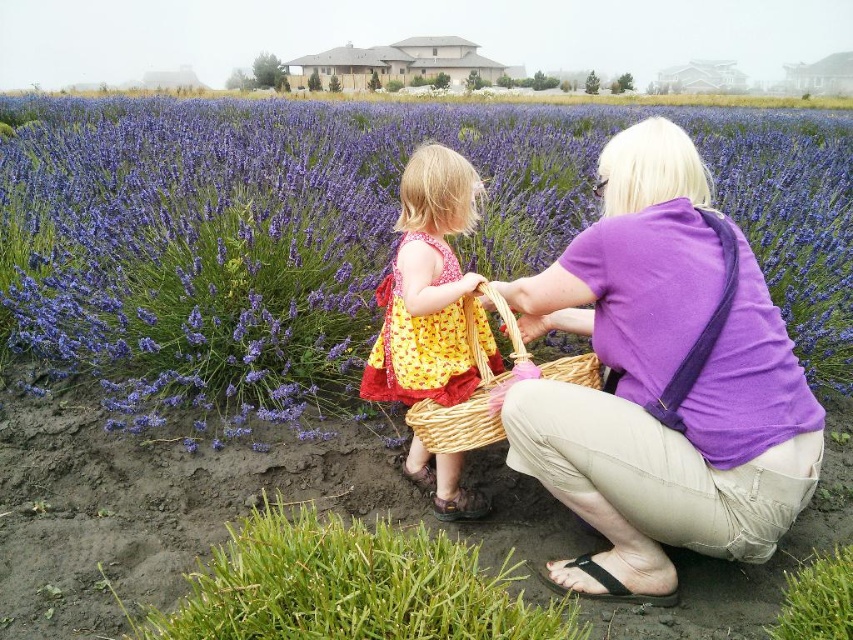
Question: Is purple soft lavender at center to the left of purple cotton shirt at center from the viewer's perspective?

Choices:
 (A) yes
 (B) no

Answer: (A)

Question: Is purple soft lavender at center thinner than woven straw basket at center?

Choices:
 (A) no
 (B) yes

Answer: (A)

Question: Which point appears closest to the camera in this image?

Choices:
 (A) (351, 241)
 (B) (639, 323)
 (C) (469, 436)

Answer: (B)

Question: Which object is closer to the camera taking this photo?

Choices:
 (A) purple cotton shirt at center
 (B) woven straw basket at center
 (C) yellow cotton dress at center

Answer: (A)

Question: Which point appears farthest from the camera in this image?

Choices:
 (A) (815, 467)
 (B) (494, 440)
 (C) (393, 344)
 (D) (114, 390)

Answer: (D)

Question: Is purple cotton shirt at center smaller than yellow cotton dress at center?

Choices:
 (A) no
 (B) yes

Answer: (A)